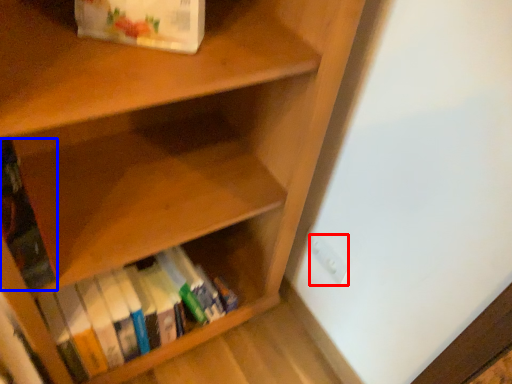
Question: Which object appears closest to the camera in this image, electric outlet (highlighted by a red box) or book (highlighted by a blue box)?

Choices:
 (A) electric outlet
 (B) book

Answer: (B)